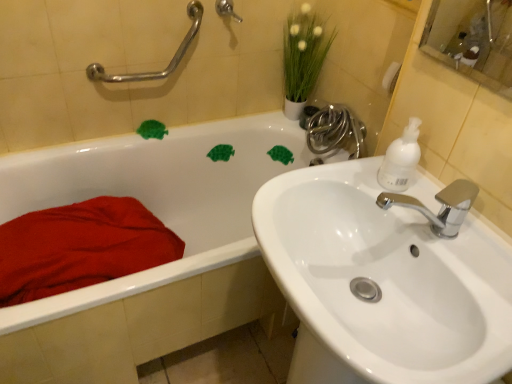
You are a GUI agent. You are given a task and a screenshot of the screen. Output one action in this format:
    pyautogui.click(x=<x>, y=<y>)
    Task: Click on the vacant space positioned to the left of white matte soap dispenser at upper right
    Image resolution: width=512 pixels, height=384 pixels.
    Given the screenshot: What is the action you would take?
    pyautogui.click(x=340, y=182)